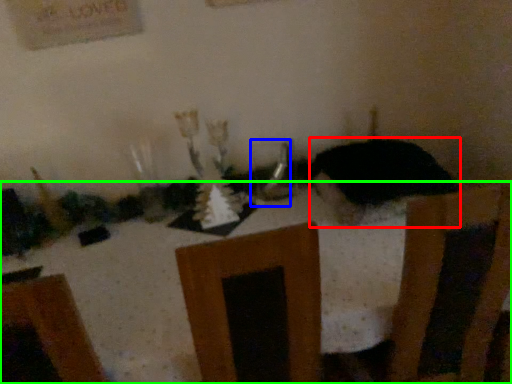
Question: Which object is positioned farthest from animal (highlighted by a red box)? Select from tableware (highlighted by a blue box) and furniture (highlighted by a green box).

Choices:
 (A) tableware
 (B) furniture

Answer: (B)